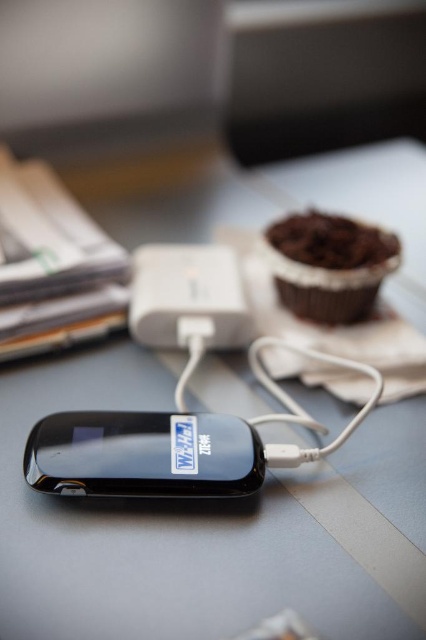
Question: Which point appears closest to the camera in this image?

Choices:
 (A) (331, 304)
 (B) (140, 285)

Answer: (A)

Question: Which object appears farthest from the camera in this image?

Choices:
 (A) black glossy smartphone at center
 (B) white plastic power bank at center
 (C) chocolate cake at upper right

Answer: (B)

Question: Does chocolate cake at upper right have a greater width compared to white plastic power bank at center?

Choices:
 (A) no
 (B) yes

Answer: (B)

Question: Can you confirm if chocolate cake at upper right is thinner than white plastic power bank at center?

Choices:
 (A) no
 (B) yes

Answer: (A)

Question: Which is farther from the chocolate cake at upper right?

Choices:
 (A) black glossy smartphone at center
 (B) white plastic power bank at center

Answer: (A)

Question: Does black glossy smartphone at center have a greater width compared to chocolate cake at upper right?

Choices:
 (A) yes
 (B) no

Answer: (A)